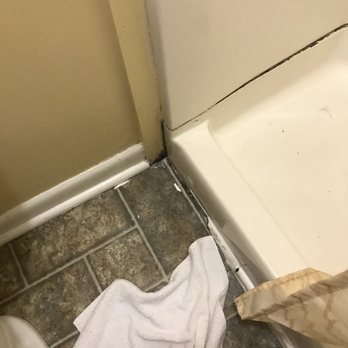
The height and width of the screenshot is (348, 348). In order to click on peach colored shower curtain in this screenshot , I will do `click(336, 310)`.